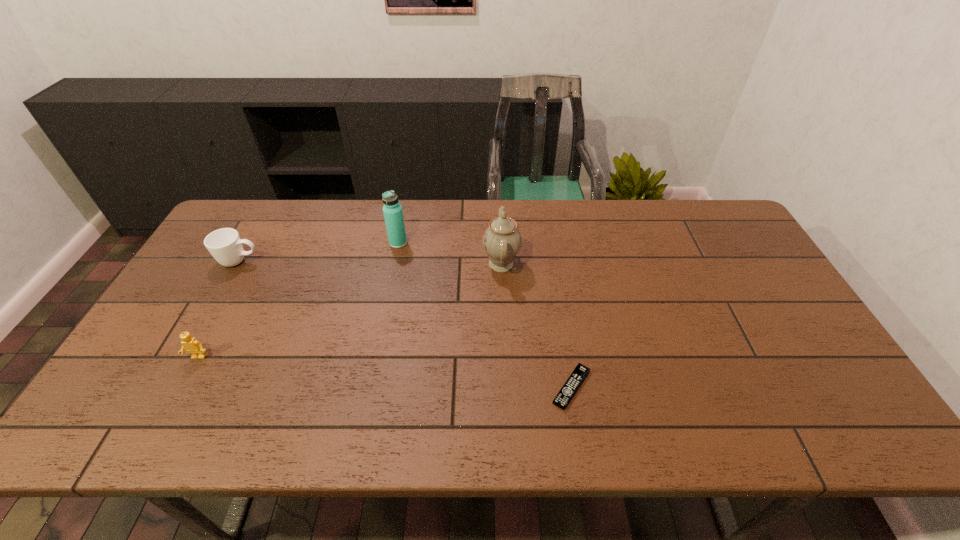
Where is `blank region between the third object from right to left and the fourth farthest object`? The image size is (960, 540). blank region between the third object from right to left and the fourth farthest object is located at coordinates (299, 300).

Find the location of a particular element. blank region between the second nearest object and the rightmost object is located at coordinates (385, 372).

Find the location of `object that is the third closest to the second object from right to left`. object that is the third closest to the second object from right to left is located at coordinates (225, 245).

The width and height of the screenshot is (960, 540). Identify the location of object that stands as the closest to the fourth object from left to right. click(392, 210).

You are a GUI agent. You are given a task and a screenshot of the screen. Output one action in this format:
    pyautogui.click(x=<x>, y=<y>)
    Task: Click on the vacant area in the image that satisfies the following two spatial constraints: 1. on the spout of the second object from right to left; 2. on the left side of the rightmost object
    
    Given the screenshot: What is the action you would take?
    507,387

At what (x,y) coordinates should I click in order to perform the action: click on free space in the image that satisfies the following two spatial constraints: 1. with the handle on the side of the shortest object; 2. on the left side of the cup. Please return your answer as a coordinate pair (x, y). Image resolution: width=960 pixels, height=540 pixels. Looking at the image, I should click on (169, 387).

Locate an element on the screen. This screenshot has height=540, width=960. free region that satisfies the following two spatial constraints: 1. on the spout of the fourth object from left to right; 2. on the face of the Lego is located at coordinates (506, 357).

Identify the location of vacant space that satisfies the following two spatial constraints: 1. on the face of the remote control; 2. on the right side of the fourth farthest object. (183, 387).